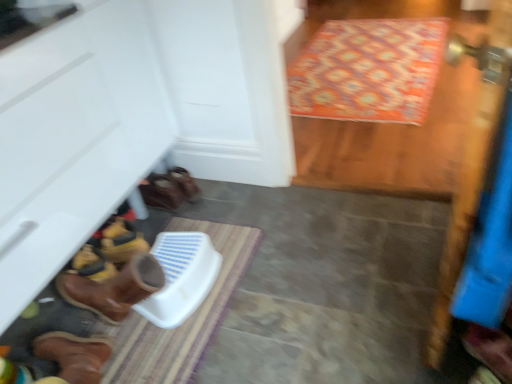
Question: From a real-world perspective, is brown leather boot at lower left, the 2th footwear in the top-to-bottom sequence, on patterned fabric doormat at upper right, which is the 1th doormat in back-to-front order?

Choices:
 (A) yes
 (B) no

Answer: (A)

Question: Is brown leather boot at lower left, which is the first footwear in bottom-to-top order, thinner than patterned fabric doormat at upper right, placed as the second doormat when sorted from bottom to top?

Choices:
 (A) yes
 (B) no

Answer: (A)

Question: Would you say patterned fabric doormat at upper right, acting as the second doormat starting from the left, is part of brown leather boot at lower left, placed as the second footwear when sorted from left to right,'s contents?

Choices:
 (A) no
 (B) yes

Answer: (A)

Question: From the image's perspective, is brown leather boot at lower left, which is the first footwear from front to back, located beneath patterned fabric doormat at upper right, which is the 1th doormat in back-to-front order?

Choices:
 (A) yes
 (B) no

Answer: (A)

Question: Is brown leather boot at lower left, placed as the second footwear when sorted from left to right, shorter than patterned fabric doormat at upper right, acting as the second doormat starting from the left?

Choices:
 (A) no
 (B) yes

Answer: (A)

Question: From the image's perspective, relative to striped fabric doormat at lower center, which appears as the first doormat when viewed from the left, is patterned fabric doormat at upper right, acting as the 1th doormat starting from the right, above or below?

Choices:
 (A) below
 (B) above

Answer: (B)

Question: Considering the positions of patterned fabric doormat at upper right, arranged as the first doormat when viewed from the top, and striped fabric doormat at lower center, placed as the first doormat when sorted from front to back, in the image, is patterned fabric doormat at upper right, arranged as the first doormat when viewed from the top, wider or thinner than striped fabric doormat at lower center, placed as the first doormat when sorted from front to back,?

Choices:
 (A) wide
 (B) thin

Answer: (A)

Question: Based on their positions, is patterned fabric doormat at upper right, arranged as the first doormat when viewed from the top, located to the left or right of striped fabric doormat at lower center, which ranks as the second doormat in right-to-left order?

Choices:
 (A) right
 (B) left

Answer: (A)

Question: In terms of height, does patterned fabric doormat at upper right, which ranks as the 2th doormat in front-to-back order, look taller or shorter compared to striped fabric doormat at lower center, the first doormat when ordered from bottom to top?

Choices:
 (A) short
 (B) tall

Answer: (B)

Question: Is point (419, 33) closer or farther from the camera than point (159, 173)?

Choices:
 (A) farther
 (B) closer

Answer: (A)

Question: In terms of size, does patterned fabric doormat at upper right, acting as the second doormat starting from the left, appear bigger or smaller than brown leather boot at lower left, which is the 1th footwear in top-to-bottom order?

Choices:
 (A) small
 (B) big

Answer: (B)

Question: Which is correct: patterned fabric doormat at upper right, placed as the second doormat when sorted from bottom to top, is inside brown leather boot at lower left, the 1th footwear positioned from the back, or outside of it?

Choices:
 (A) outside
 (B) inside

Answer: (A)

Question: Considering their positions, is patterned fabric doormat at upper right, placed as the second doormat when sorted from bottom to top, located in front of or behind brown leather boot at lower left, marked as the second footwear in a front-to-back arrangement?

Choices:
 (A) behind
 (B) front

Answer: (A)

Question: From a real-world perspective, is patterned fabric doormat at upper right, arranged as the first doormat when viewed from the top, above or below brown leather boot at lower left, acting as the first footwear starting from the right?

Choices:
 (A) below
 (B) above

Answer: (A)

Question: Considering the positions of patterned fabric doormat at upper right, placed as the second doormat when sorted from bottom to top, and brown leather boot at lower left, which is the first footwear from front to back, in the image, is patterned fabric doormat at upper right, placed as the second doormat when sorted from bottom to top, taller or shorter than brown leather boot at lower left, which is the first footwear from front to back,?

Choices:
 (A) short
 (B) tall

Answer: (A)